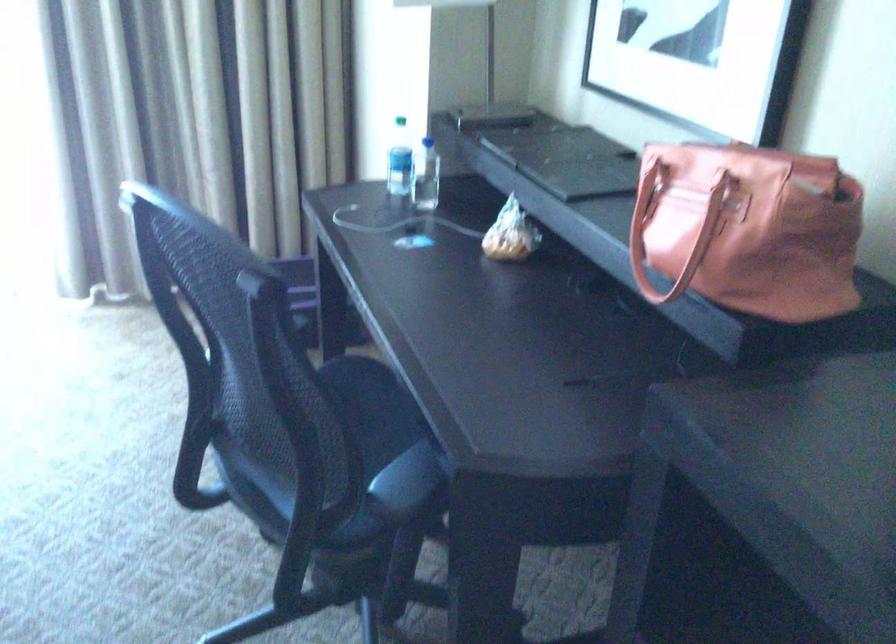
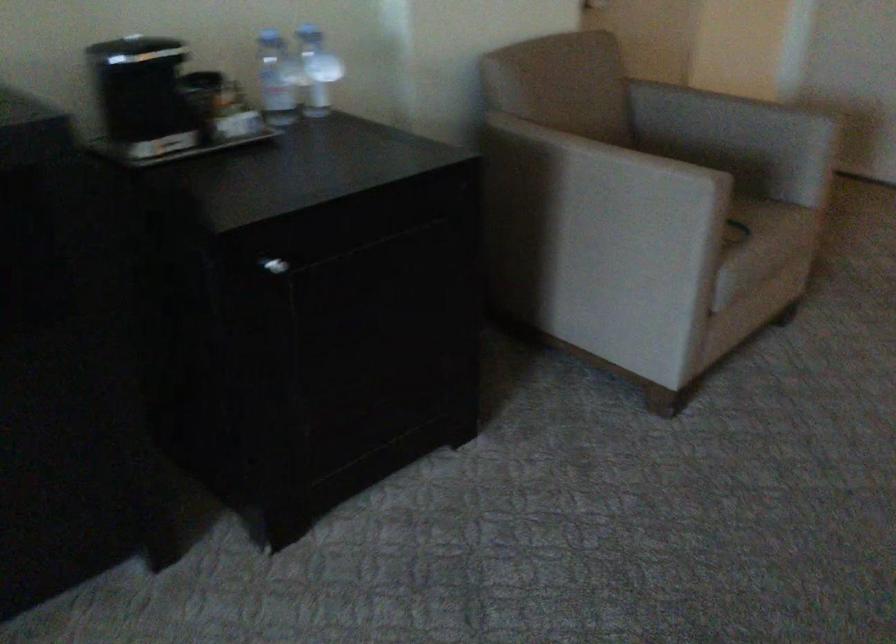
The first image is from the beginning of the video and the second image is from the end. How did the camera likely rotate when shooting the video?

The rotation direction of the camera is right-down.